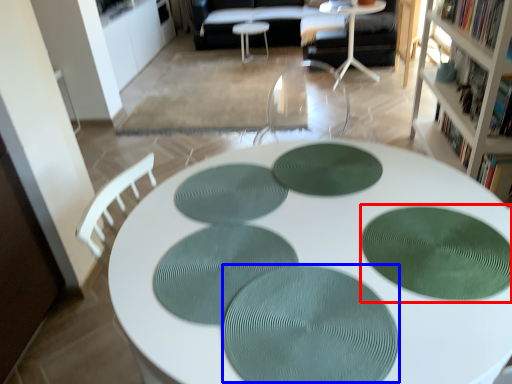
Question: Which of the following is the closest to the observer, mat (highlighted by a red box) or oval (highlighted by a blue box)?

Choices:
 (A) mat
 (B) oval

Answer: (B)